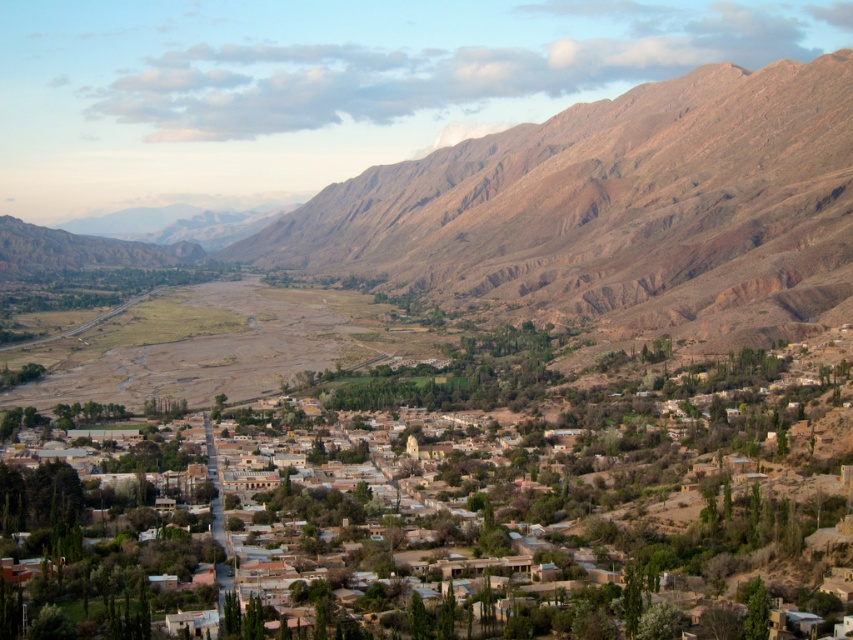
Does brown clay houses at center have a lesser width compared to brown rocky mountain at center?

Indeed, brown clay houses at center has a lesser width compared to brown rocky mountain at center.

What do you see at coordinates (613, 484) in the screenshot? I see `brown clay houses at center` at bounding box center [613, 484].

Who is more forward, (x=468, y=540) or (x=735, y=346)?

Point (x=468, y=540) is more forward.

This screenshot has width=853, height=640. I want to click on brown clay houses at center, so click(613, 484).